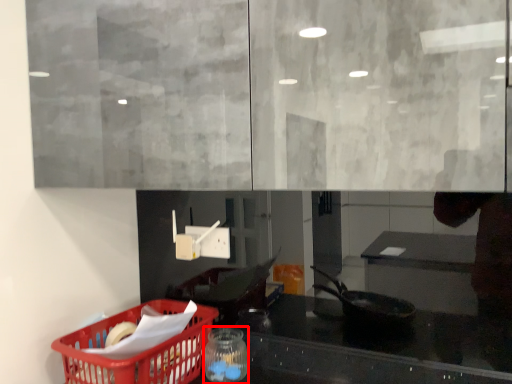
Question: In this image, where is glass jar (annotated by the red box) located relative to basket?

Choices:
 (A) right
 (B) left

Answer: (A)